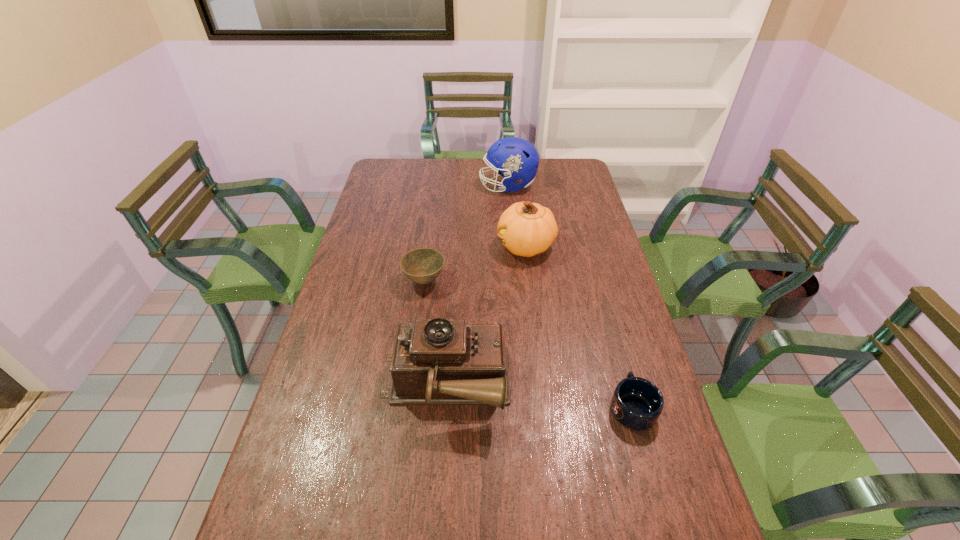
Where is `blank space located on the front face of the second farthest object`? blank space located on the front face of the second farthest object is located at coordinates (392, 246).

The image size is (960, 540). Find the location of `blank area located 0.380m on the front face of the second farthest object`. blank area located 0.380m on the front face of the second farthest object is located at coordinates (392, 246).

Where is `free space located 0.220m on the front face of the second farthest object`? The width and height of the screenshot is (960, 540). free space located 0.220m on the front face of the second farthest object is located at coordinates (436, 246).

Locate an element on the screen. This screenshot has height=540, width=960. vacant space located on the horn of the phonograph_record is located at coordinates (537, 386).

Find the location of a particular element. The image size is (960, 540). vacant area situated 0.380m on the front of the second shortest object is located at coordinates click(408, 401).

Identify the location of free space located with the handle on the side of the shortest object. This screenshot has height=540, width=960. (607, 316).

What are the coordinates of `vacant space located 0.090m with the handle on the side of the shortest object` in the screenshot? It's located at (618, 356).

The height and width of the screenshot is (540, 960). In order to click on free space located with the handle on the side of the shortest object in this screenshot , I will do `click(601, 295)`.

The image size is (960, 540). I want to click on object that is at the far edge, so click(517, 159).

Identify the location of object that is at the right edge. The width and height of the screenshot is (960, 540). (637, 403).